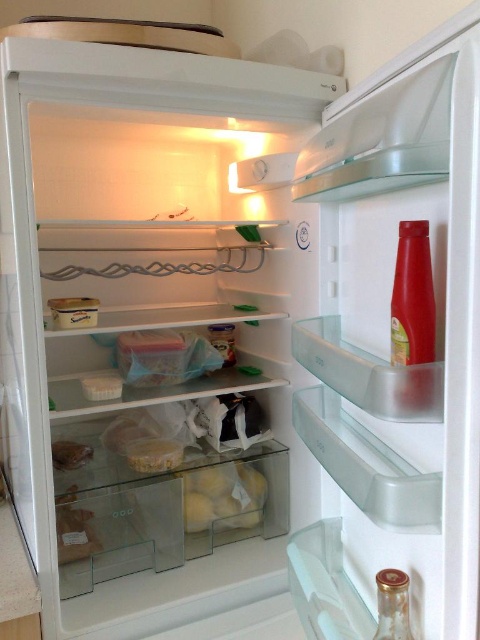
Image resolution: width=480 pixels, height=640 pixels. What do you see at coordinates (223, 497) in the screenshot?
I see `translucent plastic bag of potatoes at lower center` at bounding box center [223, 497].

Which is below, translucent plastic bag of potatoes at lower center or translucent plastic container at center?

Positioned lower is translucent plastic bag of potatoes at lower center.

Image resolution: width=480 pixels, height=640 pixels. Describe the element at coordinates (223, 497) in the screenshot. I see `translucent plastic bag of potatoes at lower center` at that location.

The width and height of the screenshot is (480, 640). What are the coordinates of `translucent plastic bag of potatoes at lower center` in the screenshot? It's located at (223, 497).

Does translucent plastic bag of potatoes at lower center appear over translucent plastic bag at lower center?

Actually, translucent plastic bag of potatoes at lower center is below translucent plastic bag at lower center.

In order to click on translucent plastic bag of potatoes at lower center in this screenshot , I will do `click(223, 497)`.

Where is `translucent plastic bag of potatoes at lower center`? Image resolution: width=480 pixels, height=640 pixels. translucent plastic bag of potatoes at lower center is located at coordinates (223, 497).

Identify the location of translucent plastic bag at lower left. Image resolution: width=480 pixels, height=640 pixels. (73, 529).

Between translucent plastic bag at lower left and translucent plastic bag at lower center, which one has more height?

With more height is translucent plastic bag at lower left.

Is point (69, 497) behind point (50, 445)?

Yes, point (69, 497) is farther from viewer.

The width and height of the screenshot is (480, 640). Identify the location of translucent plastic bag at lower left. (73, 529).